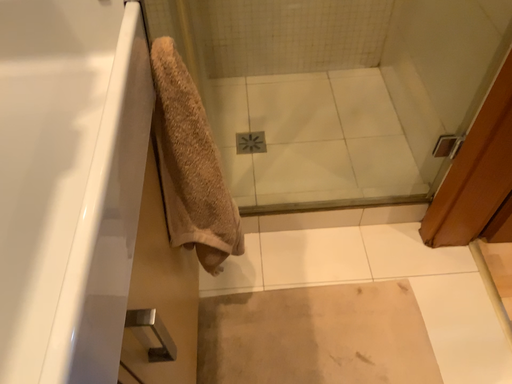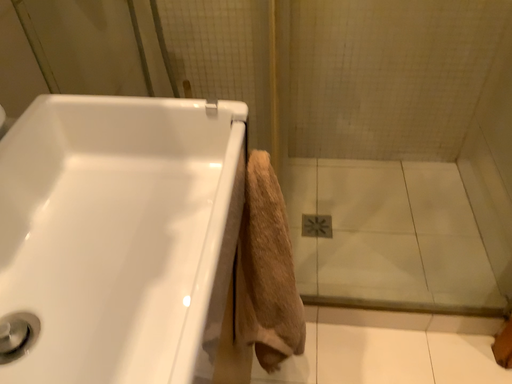
Question: Which way did the camera rotate in the video?

Choices:
 (A) rotated left
 (B) rotated right

Answer: (A)